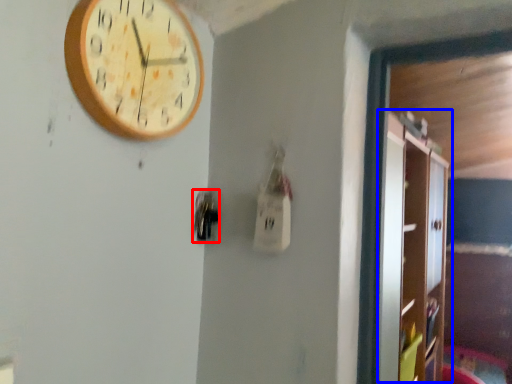
Question: Which point is closer to the camera, door handle (highlighted by a red box) or dresser (highlighted by a blue box)?

Choices:
 (A) door handle
 (B) dresser

Answer: (A)